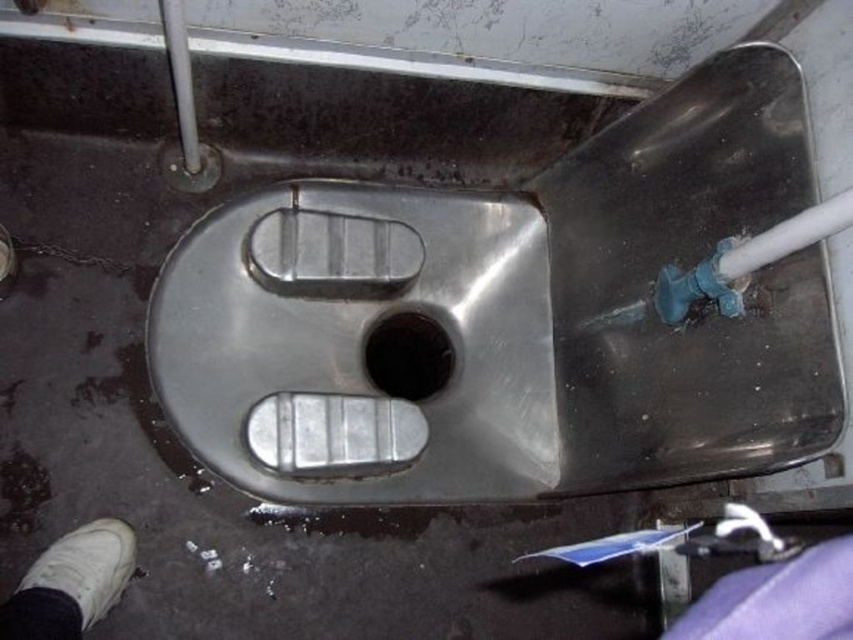
Which is more to the right, stainless steel urinal at center or black rubber drain at center?

black rubber drain at center

Can you confirm if stainless steel urinal at center is shorter than black rubber drain at center?

No.

Image resolution: width=853 pixels, height=640 pixels. In order to click on stainless steel urinal at center in this screenshot , I will do `click(358, 344)`.

Does stainless steel sink at center have a greater width compared to stainless steel urinal at center?

Yes.

This screenshot has height=640, width=853. Describe the element at coordinates (517, 314) in the screenshot. I see `stainless steel sink at center` at that location.

What do you see at coordinates (517, 314) in the screenshot? The width and height of the screenshot is (853, 640). I see `stainless steel sink at center` at bounding box center [517, 314].

Find the location of `stainless steel sink at center`. stainless steel sink at center is located at coordinates (517, 314).

Based on the photo, is stainless steel sink at center below black rubber drain at center?

Incorrect, stainless steel sink at center is not positioned below black rubber drain at center.

Between stainless steel sink at center and black rubber drain at center, which one is positioned lower?

Positioned lower is black rubber drain at center.

Between point (445, 387) and point (392, 376), which one is positioned behind?

Point (392, 376)

At what (x,y) coordinates should I click in order to perform the action: click on stainless steel sink at center. Please return your answer as a coordinate pair (x, y). Looking at the image, I should click on (517, 314).